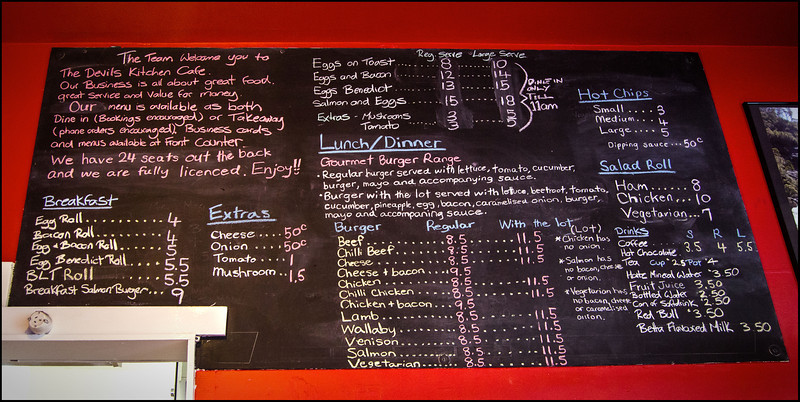
Identify the location of menue chalk board. The height and width of the screenshot is (402, 800). (354, 182).